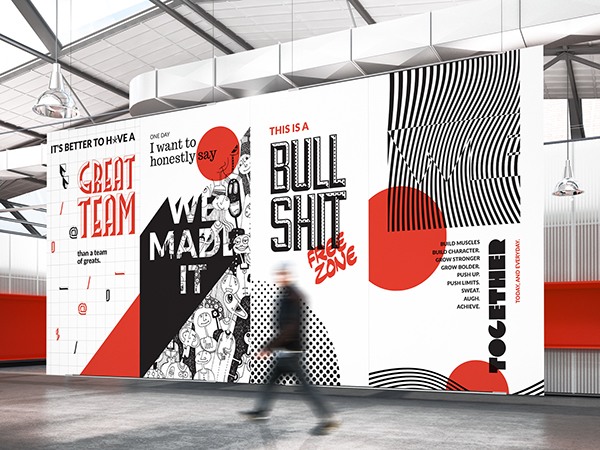
Find the location of a particular element. The height and width of the screenshot is (450, 600). windows is located at coordinates (85, 19), (12, 29).